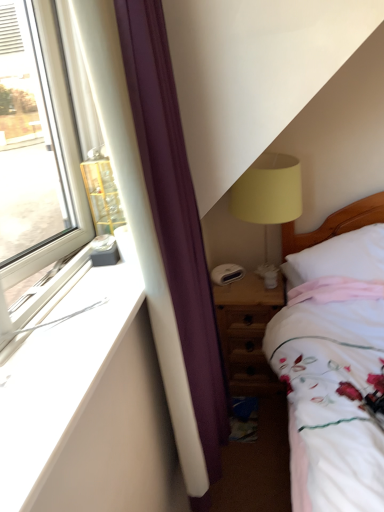
I want to click on blank space situated above wooden nightstand at lower right (from a real-world perspective), so click(250, 283).